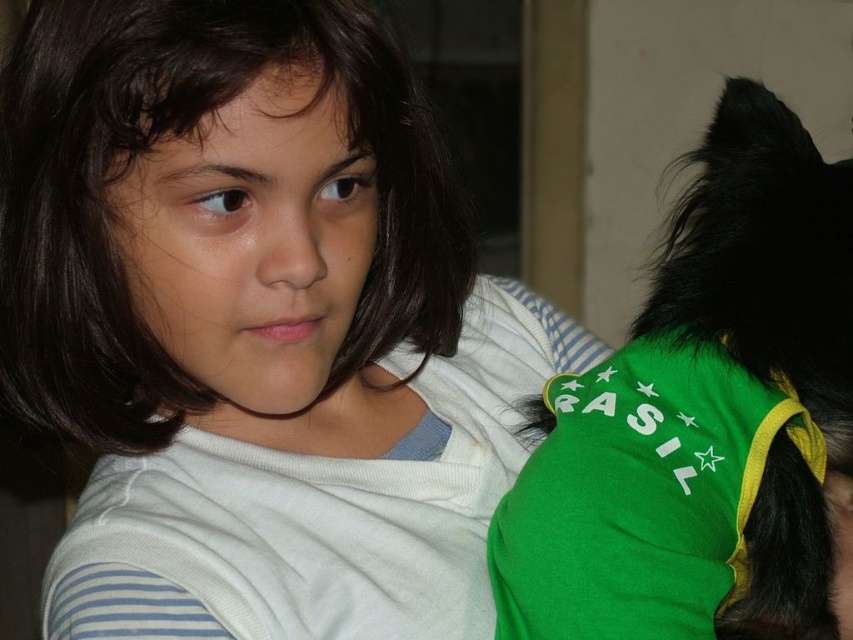
Does green fabric dog at right have a greater height compared to dark brown hair at center?

Indeed, green fabric dog at right has a greater height compared to dark brown hair at center.

Does green fabric dog at right have a lesser height compared to dark brown hair at center?

In fact, green fabric dog at right may be taller than dark brown hair at center.

Between point (554, 524) and point (18, 344), which one is positioned in front?

Point (554, 524) is in front.

Identify the location of green fabric dog at right. (701, 419).